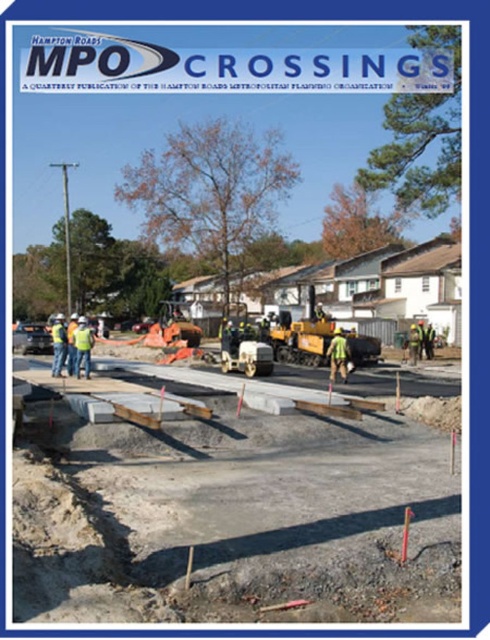
Who is lower down, yellow asphalt paver at center or yellow reflective vests at center?

yellow asphalt paver at center is lower down.

Describe the element at coordinates (302, 333) in the screenshot. This screenshot has width=490, height=640. I see `yellow asphalt paver at center` at that location.

This screenshot has width=490, height=640. Find the location of `yellow asphalt paver at center`. yellow asphalt paver at center is located at coordinates (302, 333).

Locate an element on the screen. yellow asphalt paver at center is located at coordinates (302, 333).

Can you confirm if yellow asphalt paver at center is wider than green reflective vest at center?

Incorrect, yellow asphalt paver at center's width does not surpass green reflective vest at center's.

Identify the location of yellow asphalt paver at center. (302, 333).

Where is `yellow asphalt paver at center`? yellow asphalt paver at center is located at coordinates (302, 333).

Can you confirm if gray concrete slabs at center is shorter than yellow reflective vests at center?

Indeed, gray concrete slabs at center has a lesser height compared to yellow reflective vests at center.

Is gray concrete slabs at center bigger than yellow reflective vests at center?

Actually, gray concrete slabs at center might be smaller than yellow reflective vests at center.

Identify the location of gray concrete slabs at center. (224, 504).